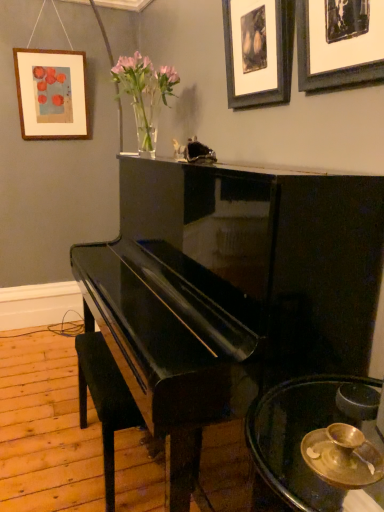
Question: From the image's perspective, is gold metallic bowl at lower right located above or below glossy black piano at center?

Choices:
 (A) below
 (B) above

Answer: (A)

Question: Considering the positions of gold metallic bowl at lower right and glossy black piano at center in the image, is gold metallic bowl at lower right taller or shorter than glossy black piano at center?

Choices:
 (A) short
 (B) tall

Answer: (A)

Question: Based on their relative distances, which object is farther from the black matte picture frame at upper right, the first picture frame when ordered from right to left?

Choices:
 (A) translucent glass vase at upper center
 (B) gold metallic bowl at lower right
 (C) glossy black piano at center
 (D) black leather music stool at lower left
 (E) wooden picture frame at upper left, which is counted as the first picture frame, starting from the back

Answer: (E)

Question: Based on their relative distances, which object is nearer to the translucent glass vase at upper center?

Choices:
 (A) wooden picture frame at upper center, the 2th picture frame in the front-to-back sequence
 (B) gold metallic bowl at lower right
 (C) glossy black piano at center
 (D) black matte picture frame at upper right, which ranks as the 1th picture frame in front-to-back order
 (E) wooden picture frame at upper left, placed as the 1th picture frame when sorted from left to right

Answer: (A)